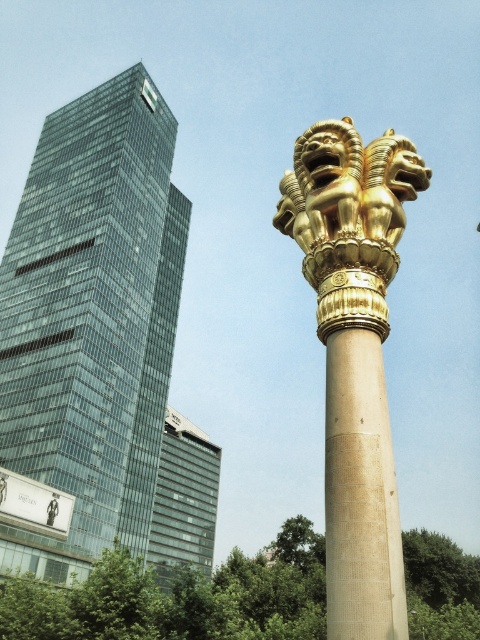
Is beige stone column at center in front of glassy reflective building at center?

Yes, it is in front of glassy reflective building at center.

Which of these two, beige stone column at center or glassy reflective building at center, stands shorter?

beige stone column at center is shorter.

Identify the location of beige stone column at center. The image size is (480, 640). (360, 496).

Does glassy metallic skyscraper at left appear over gold polished column at center?

Yes.

Which is behind, point (63, 173) or point (325, 467)?

The point (63, 173) is behind.

Where is `glassy metallic skyscraper at left`? glassy metallic skyscraper at left is located at coordinates (91, 323).

Is glassy metallic skyscraper at left to the left of beige stone column at center from the viewer's perspective?

Indeed, glassy metallic skyscraper at left is positioned on the left side of beige stone column at center.

Is glassy metallic skyscraper at left bigger than beige stone column at center?

Yes.

The height and width of the screenshot is (640, 480). What do you see at coordinates (91, 323) in the screenshot? I see `glassy metallic skyscraper at left` at bounding box center [91, 323].

At what (x,y) coordinates should I click in order to perform the action: click on glassy metallic skyscraper at left. Please return your answer as a coordinate pair (x, y). The image size is (480, 640). Looking at the image, I should click on (91, 323).